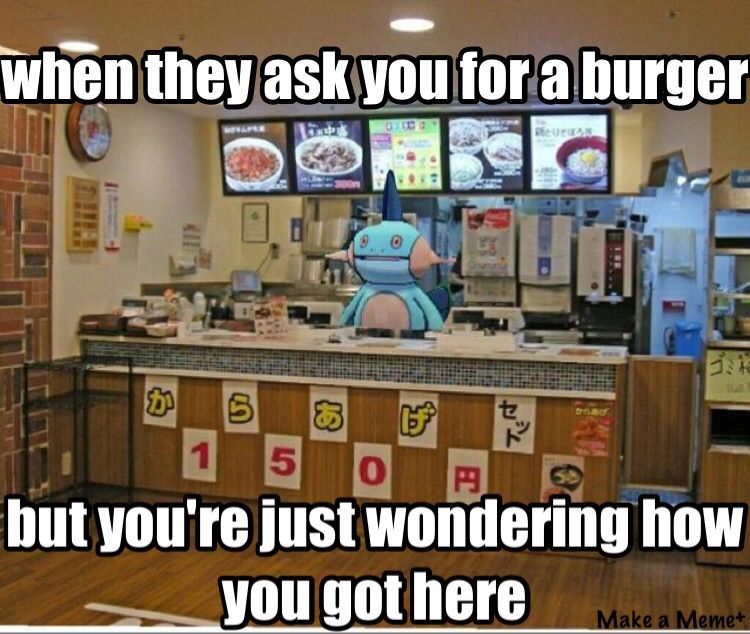
Identify the location of door. (668, 403).